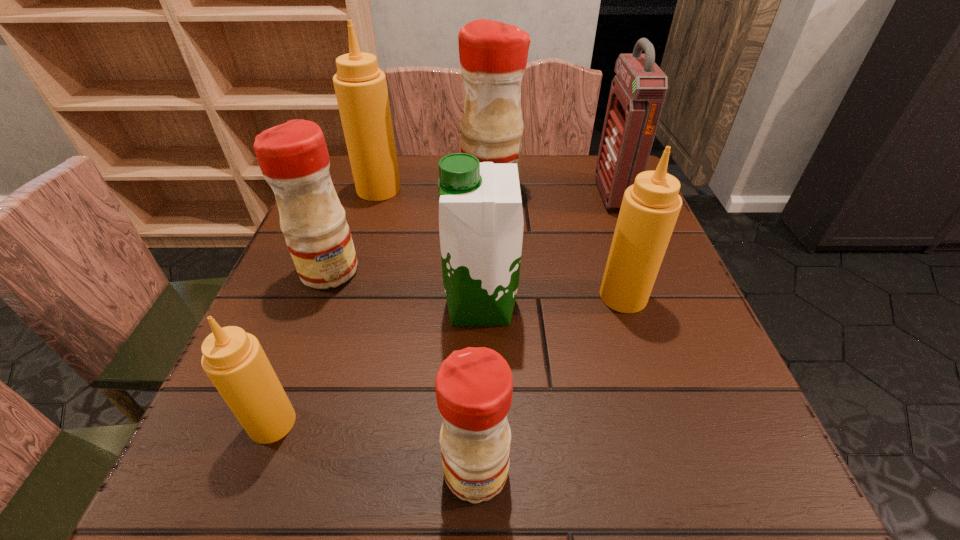
In the image, there is a desktop. Where is `vacant area at the left edge`? vacant area at the left edge is located at coordinates (278, 346).

Where is `vacant space at the right edge of the desktop`? This screenshot has height=540, width=960. vacant space at the right edge of the desktop is located at coordinates (640, 327).

Where is `unoccupied position between the soya milk and the rightmost tan condiment`? Image resolution: width=960 pixels, height=540 pixels. unoccupied position between the soya milk and the rightmost tan condiment is located at coordinates (552, 301).

Identify the location of vacant area that lies between the second nearest red condiment and the nearest tan condiment. This screenshot has height=540, width=960. (300, 347).

Image resolution: width=960 pixels, height=540 pixels. Find the location of `free space that is in between the soya milk and the second farthest tan condiment`. free space that is in between the soya milk and the second farthest tan condiment is located at coordinates (552, 301).

The image size is (960, 540). What are the coordinates of `free space between the red first-aid kit and the nearest red condiment` in the screenshot? It's located at (544, 333).

Locate an element on the screen. The image size is (960, 540). unoccupied position between the biggest tan condiment and the soya milk is located at coordinates (430, 247).

Find the location of a particular element. free space that is in between the first-aid kit and the soya milk is located at coordinates (547, 250).

You are a GUI agent. You are given a task and a screenshot of the screen. Output one action in this format:
    pyautogui.click(x=<x>, y=<y>)
    Task: Click on the blank region between the second smallest red condiment and the soya milk
    This screenshot has height=540, width=960.
    Given the screenshot: What is the action you would take?
    pyautogui.click(x=405, y=288)

You are a GUI agent. You are given a task and a screenshot of the screen. Output one action in this format:
    pyautogui.click(x=<x>, y=<y>)
    Task: Click on the object identified as the third closest to the rightmost condiment
    
    Given the screenshot: What is the action you would take?
    pyautogui.click(x=493, y=55)